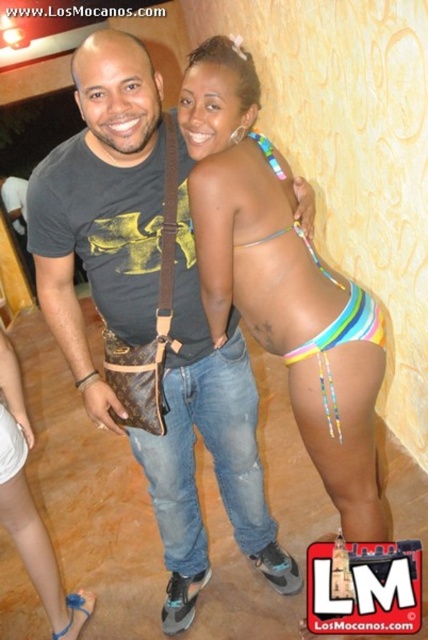
Question: Is matte black t-shirt at center closer to the viewer compared to white fabric underwear at lower left?

Choices:
 (A) yes
 (B) no

Answer: (A)

Question: Which point is closer to the camera?

Choices:
 (A) white fabric skirt at lower left
 (B) matte black t-shirt at center
 (C) multicolored bikini bottom at center

Answer: (B)

Question: Observing the image, what is the correct spatial positioning of matte black t-shirt at center in reference to multicolored bikini bottom at center?

Choices:
 (A) below
 (B) above

Answer: (A)

Question: Which is nearer to the blue fabric sandal at lower left?

Choices:
 (A) multicolored bikini bottom at center
 (B) white fabric underwear at lower left
 (C) matte black t-shirt at center

Answer: (B)

Question: Which point is closer to the camera?

Choices:
 (A) white fabric skirt at lower left
 (B) white fabric underwear at lower left

Answer: (A)

Question: Can you confirm if white fabric skirt at lower left is smaller than white fabric underwear at lower left?

Choices:
 (A) no
 (B) yes

Answer: (A)